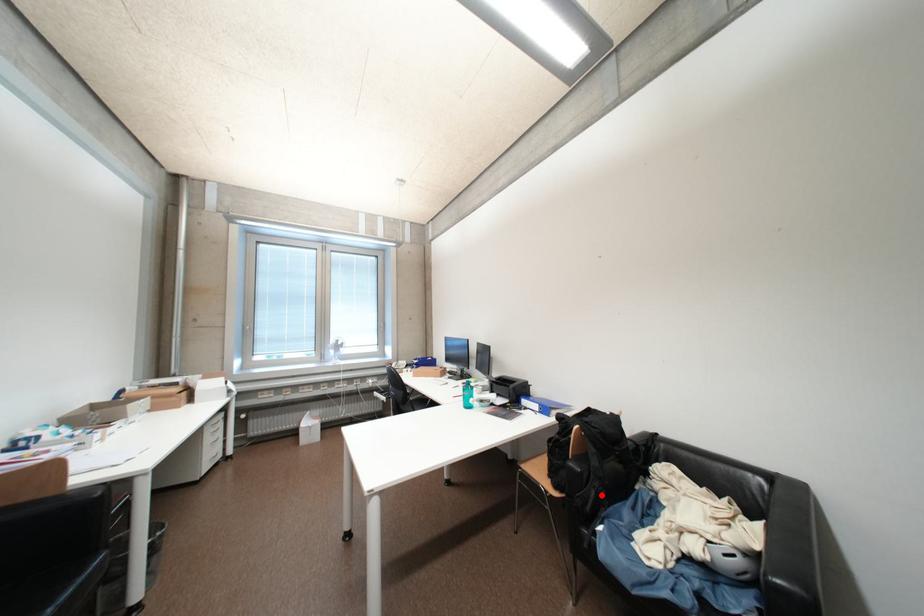
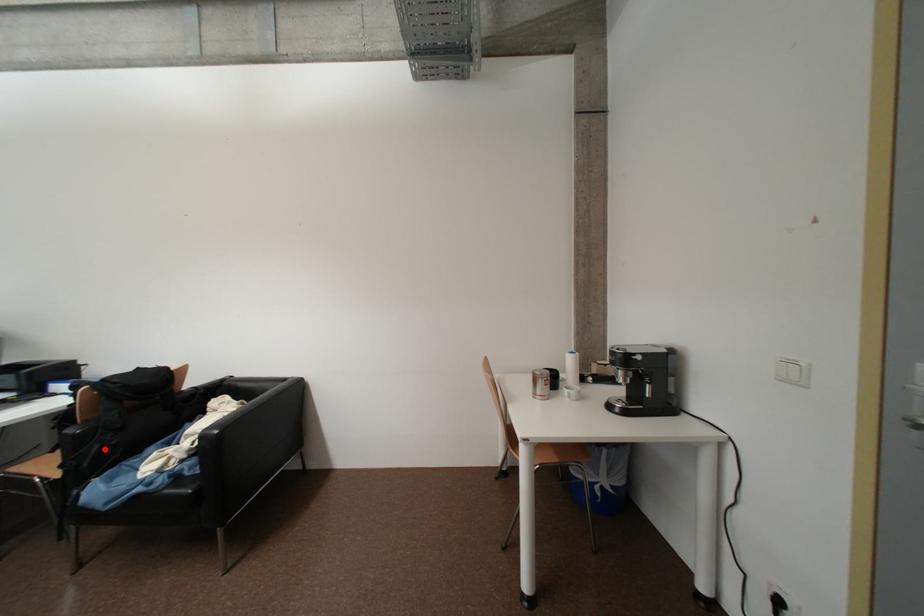
I am providing you with two images of the same scene from different viewpoints. A red point is marked on the first image and another point is marked on the second image. Do the highlighted points in image1 and image2 indicate the same real-world spot?

Yes